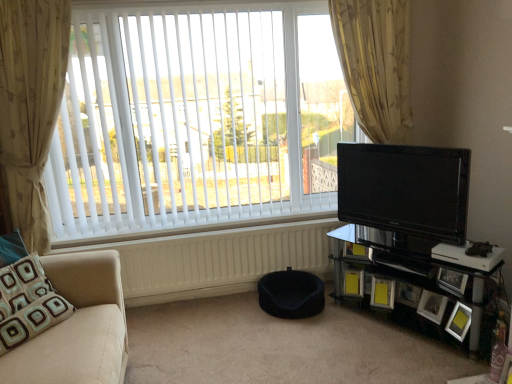
Find the location of `vacant point above white matte radiator at lower center (from a real-world perspective)`. vacant point above white matte radiator at lower center (from a real-world perspective) is located at coordinates (161, 235).